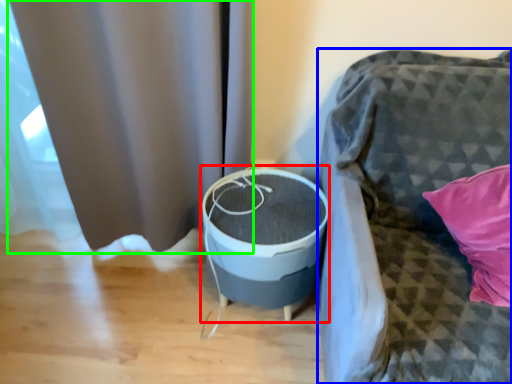
Question: Which is farther away from round table (highlighted by a red box)? furniture (highlighted by a blue box) or curtain (highlighted by a green box)?

Choices:
 (A) furniture
 (B) curtain

Answer: (B)